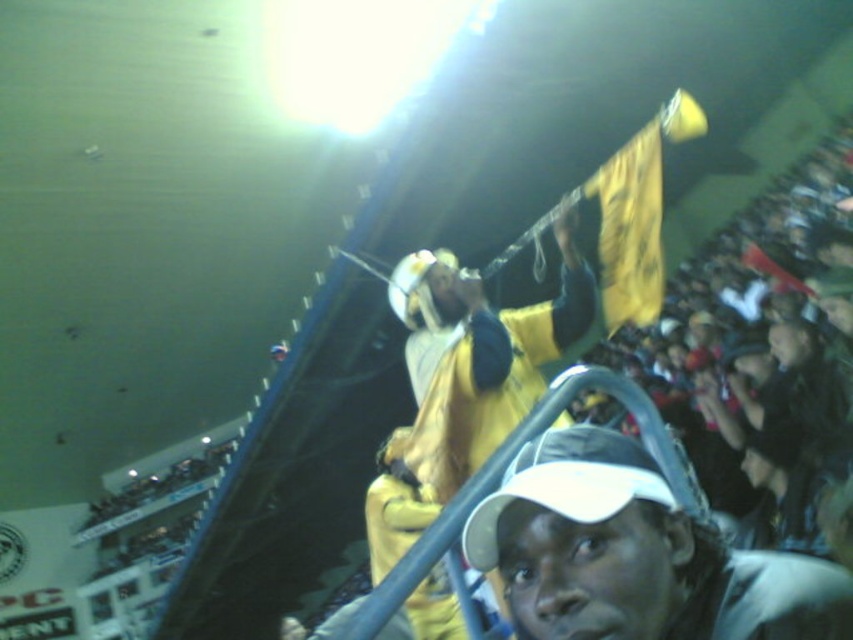
You are a photographer at the stadium and want to capture a photo that includes both the white matte cap at center and the yellow fabric at upper center. Which object should you adjust your camera to focus on first if you want to ensure both are in frame without zooming in or out?

The white matte cap at center has a smaller width compared to the yellow fabric at upper center. Since it is narrower, you should focus on the wider yellow fabric at upper center first to ensure the entire cap fits within the frame while accommodating the larger fabric.

You are a photographer trying to capture a clear shot of both the white matte cap at center and the yellow fabric at upper center in the stadium. Based on their positions, which object should you focus on first to ensure it doesn t get obscured by the other?

The white matte cap at center has a lesser height compared to the yellow fabric at upper center, so you should focus on the white matte cap at center first to prevent it from being blocked by the taller yellow fabric at upper center.

You are standing in the stadium and want to take a photo of the point at coordinates point (653, 467). The camera you are using has a focal length of 50mm and a sensor size of 24mm x 36mm. What is the minimum distance you need to move forward or backward to ensure the point is within the camera frame?

The point at coordinates point (653, 467) is 4.76 feet away from the viewer. To ensure it is within the camera frame, you need to adjust your distance based on the camera specifications. However, without additional information about the field of view or desired framing, an exact distance cannot be calculated. Please provide more details for a precise answer.